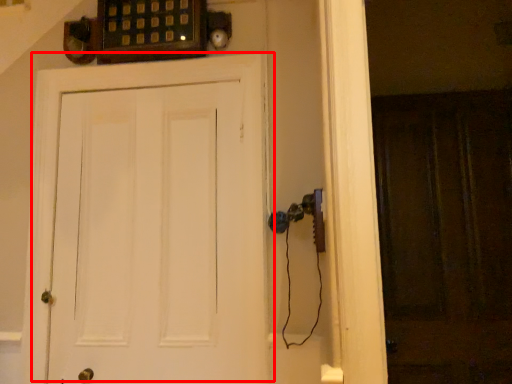
Question: Observing the image, what is the correct spatial positioning of door (annotated by the red box) in reference to screen door?

Choices:
 (A) left
 (B) right

Answer: (A)